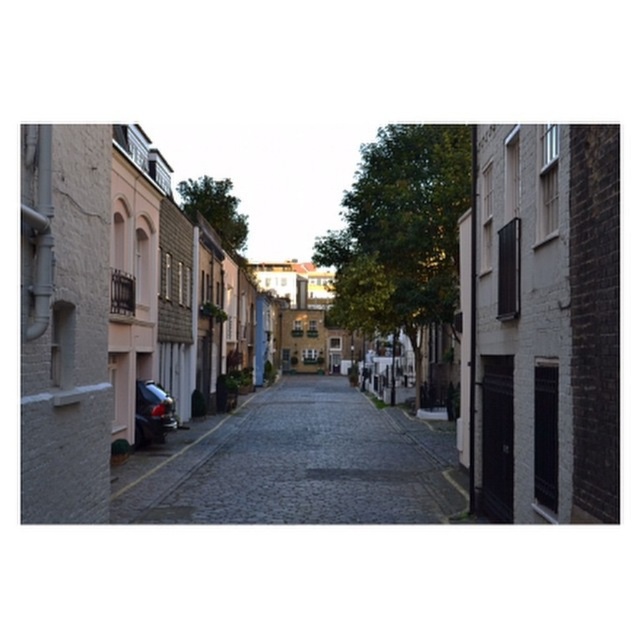
Is point (260, 433) farther from camera compared to point (176, 416)?

Yes, point (260, 433) is farther from viewer.

Does dark gray cobblestone alley at center appear on the left side of shiny metallic car at lower left?

In fact, dark gray cobblestone alley at center is to the right of shiny metallic car at lower left.

Who is more distant from viewer, (269, 497) or (148, 394)?

Point (148, 394)

Locate an element on the screen. dark gray cobblestone alley at center is located at coordinates (301, 465).